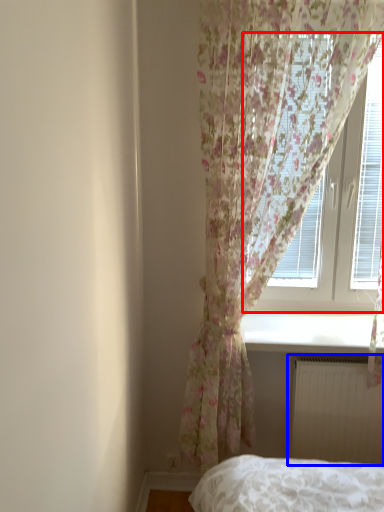
Question: Which object is closer to the camera taking this photo, window (highlighted by a red box) or radiator (highlighted by a blue box)?

Choices:
 (A) window
 (B) radiator

Answer: (B)